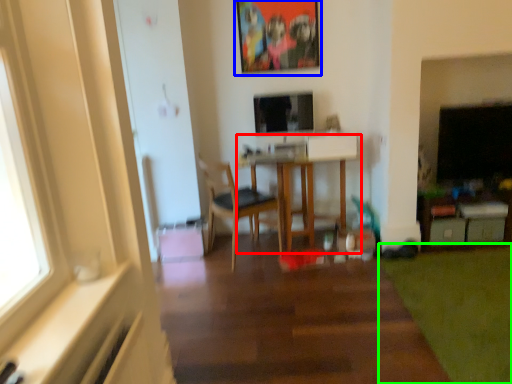
Question: Which is farther away from table (highlighted by a red box)? picture frame (highlighted by a blue box) or grass (highlighted by a green box)?

Choices:
 (A) picture frame
 (B) grass

Answer: (B)